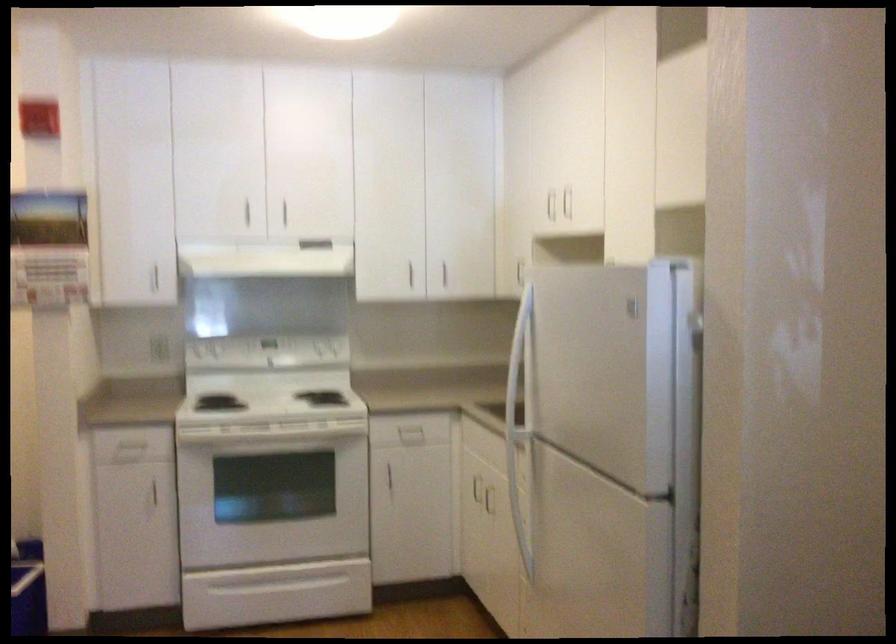
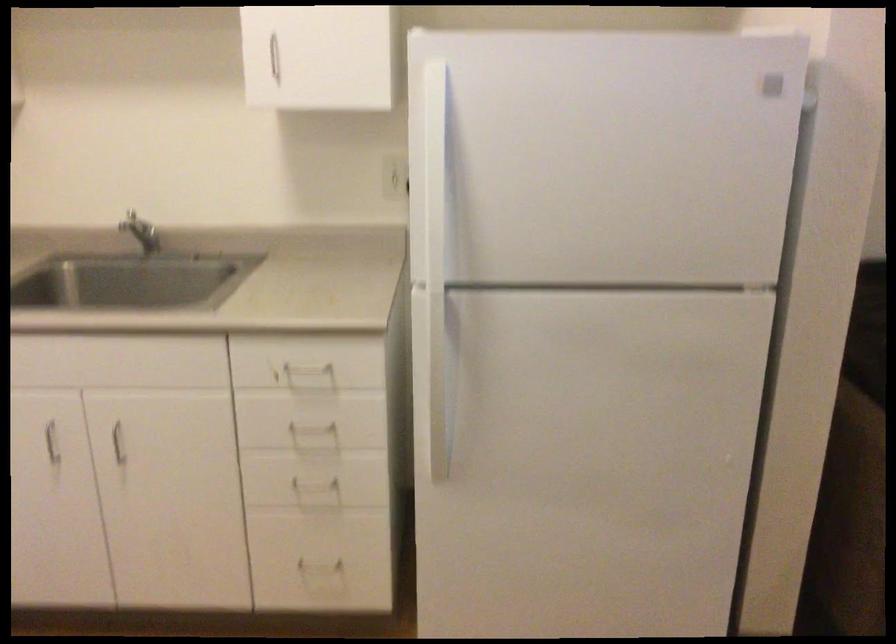
Locate, in the second image, the point that corresponds to [479,487] in the first image.

(52, 442)